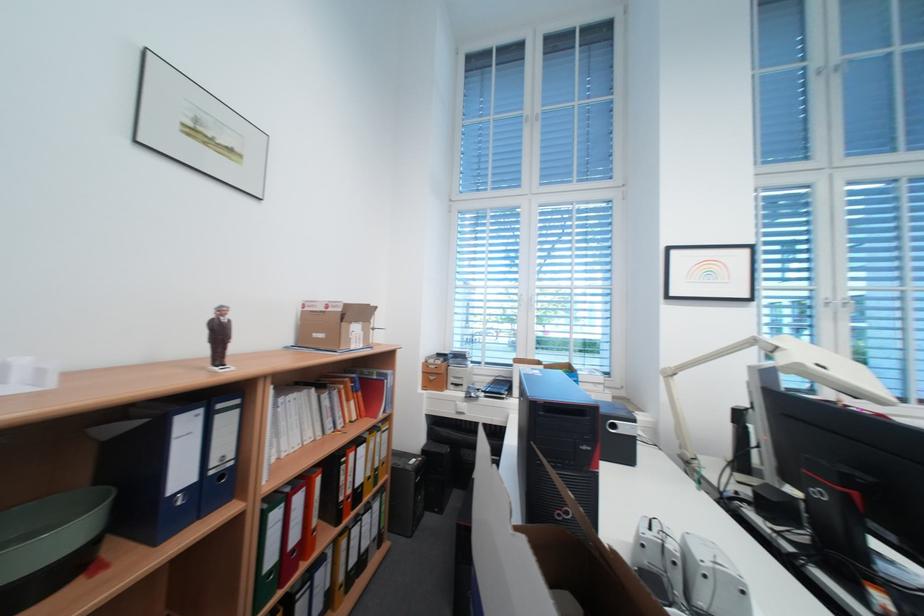
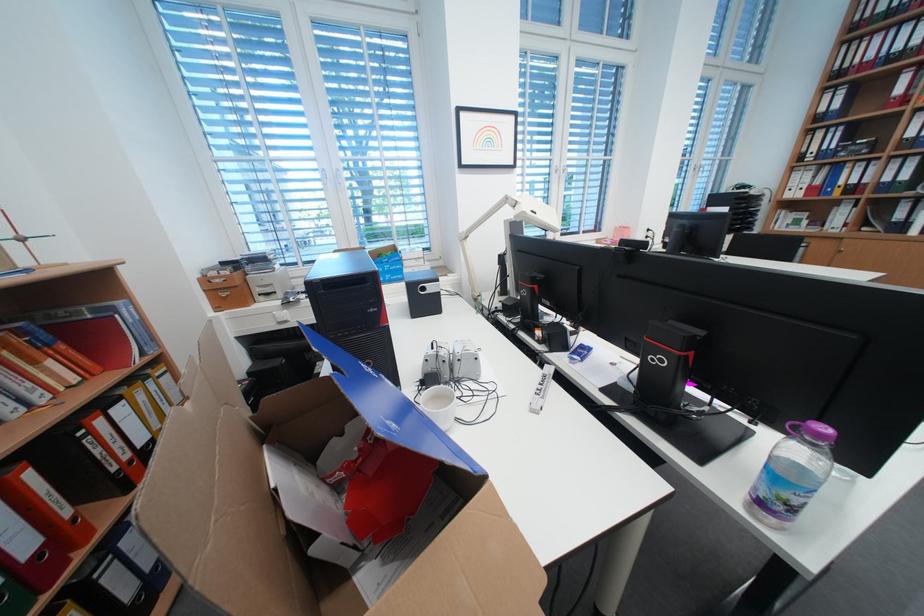
The first image is from the beginning of the video and the second image is from the end. How did the camera likely rotate when shooting the video?

The rotation direction of the camera is right-down.